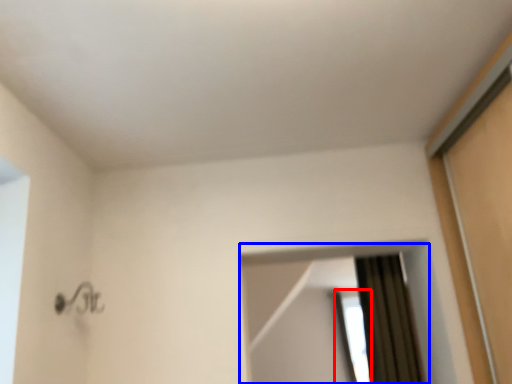
Question: Among these objects, which one is nearest to the camera, window (highlighted by a red box) or mirror (highlighted by a blue box)?

Choices:
 (A) window
 (B) mirror

Answer: (B)